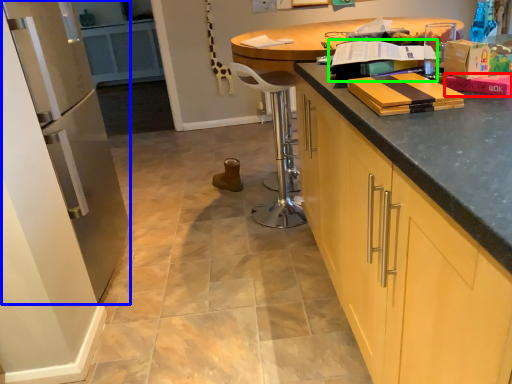
Question: Which object is positioned closest to book (highlighted by a red box)? Select from appliance (highlighted by a blue box) and book (highlighted by a green box).

Choices:
 (A) appliance
 (B) book

Answer: (B)